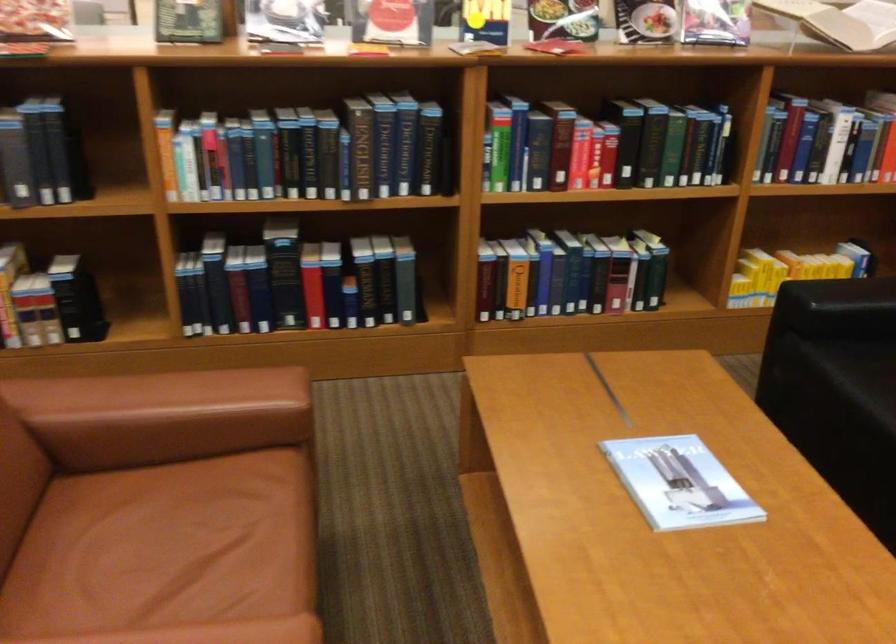
This screenshot has height=644, width=896. What do you see at coordinates (161, 415) in the screenshot?
I see `a sofa armrest` at bounding box center [161, 415].